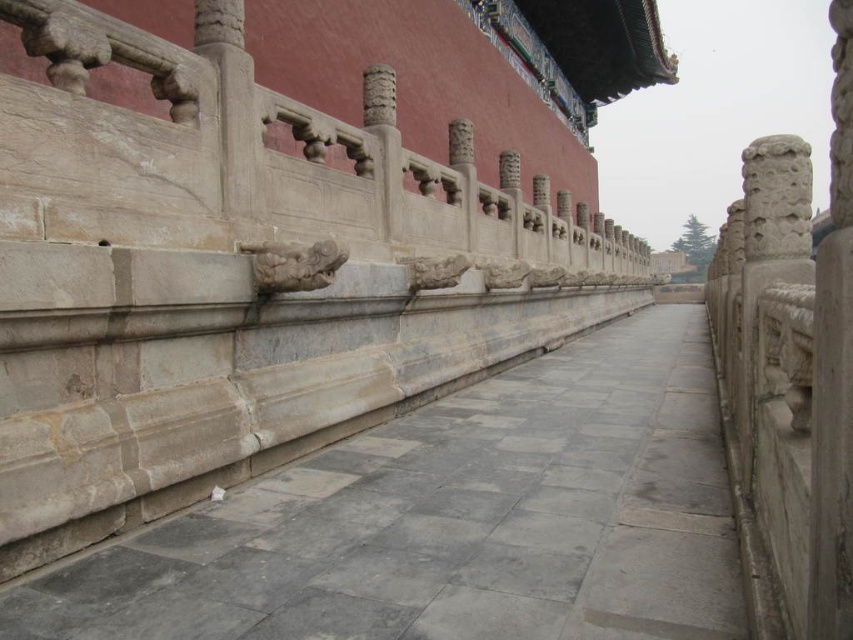
Is gray stone path at center wider than gray stone railing at center?

No, gray stone path at center is not wider than gray stone railing at center.

Does gray stone path at center appear on the left side of gray stone railing at center?

Incorrect, gray stone path at center is not on the left side of gray stone railing at center.

Is point (575, 545) positioned after point (584, 232)?

That is False.

Where is `gray stone path at center`? The height and width of the screenshot is (640, 853). gray stone path at center is located at coordinates (453, 518).